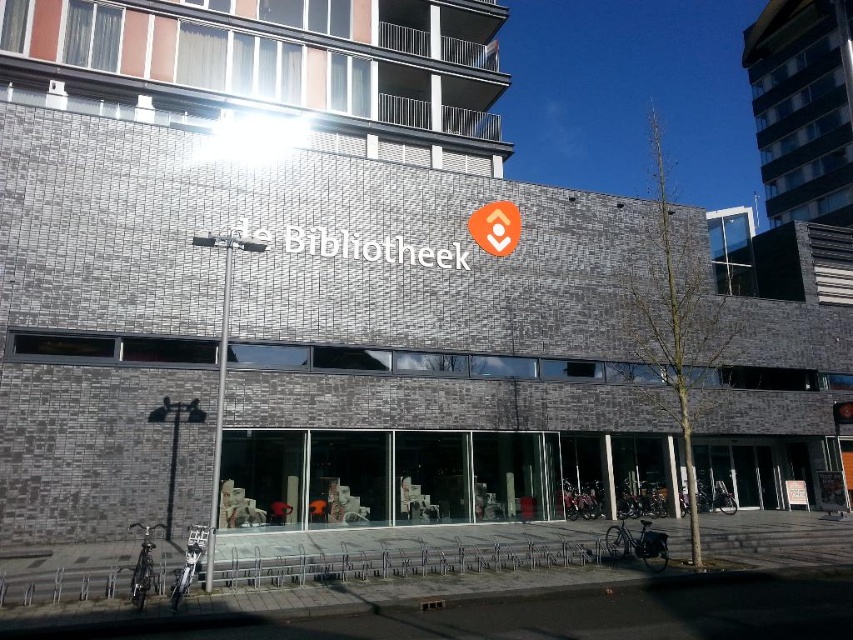
Is metallic silver street sign at center taller than orange fabric sign at center?

No, metallic silver street sign at center is not taller than orange fabric sign at center.

Which is in front, point (225, 326) or point (511, 237)?

Point (225, 326) is more forward.

What do you see at coordinates (221, 371) in the screenshot? I see `metallic silver street sign at center` at bounding box center [221, 371].

Locate an element on the screen. The width and height of the screenshot is (853, 640). metallic silver street sign at center is located at coordinates (221, 371).